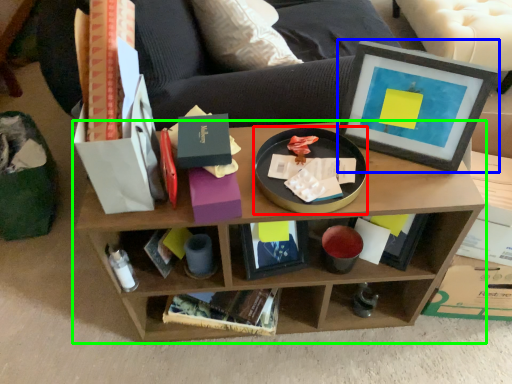
Question: Which object is the farthest from round table (highlighted by a red box)? Choose among these: picture frame (highlighted by a blue box) or shelf (highlighted by a green box).

Choices:
 (A) picture frame
 (B) shelf

Answer: (B)